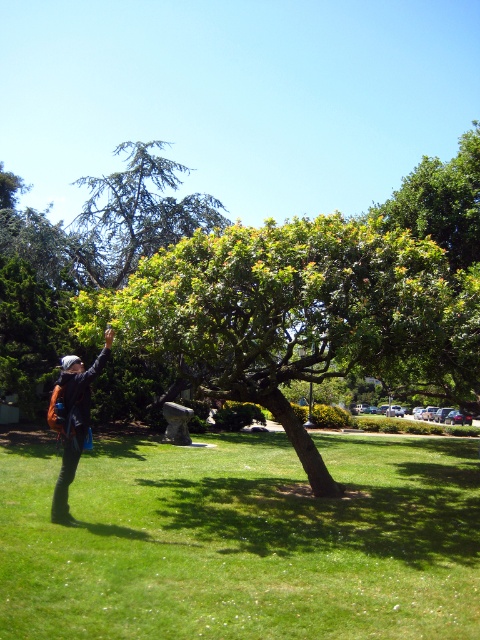
Is green grass at lower left above dark blue denim jacket at left?

Actually, green grass at lower left is below dark blue denim jacket at left.

Who is lower down, green grass at lower left or dark blue denim jacket at left?

green grass at lower left is below.

Identify the location of green grass at lower left. (242, 541).

The width and height of the screenshot is (480, 640). I want to click on green grass at lower left, so click(x=242, y=541).

Between green leafy tree at center and dark blue denim jacket at left, which one has less height?

Standing shorter between the two is dark blue denim jacket at left.

Can you confirm if green leafy tree at center is thinner than dark blue denim jacket at left?

No, green leafy tree at center is not thinner than dark blue denim jacket at left.

Between point (332, 312) and point (49, 413), which one is positioned behind?

The point (332, 312) is behind.

Where is `green leafy tree at center`? green leafy tree at center is located at coordinates (299, 314).

Who is shorter, green grass at lower left or green leafy tree at center?

With less height is green grass at lower left.

From the picture: Is green grass at lower left thinner than green leafy tree at center?

Yes, green grass at lower left is thinner than green leafy tree at center.

Which is in front, point (308, 580) or point (404, 232)?

Point (308, 580) is in front.

Locate an element on the screen. The image size is (480, 640). green grass at lower left is located at coordinates (242, 541).